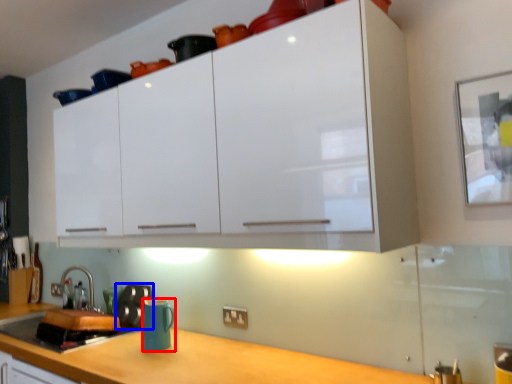
Question: Which object is further to the camera taking this photo, mug (highlighted by a red box) or appliance (highlighted by a blue box)?

Choices:
 (A) mug
 (B) appliance

Answer: (B)